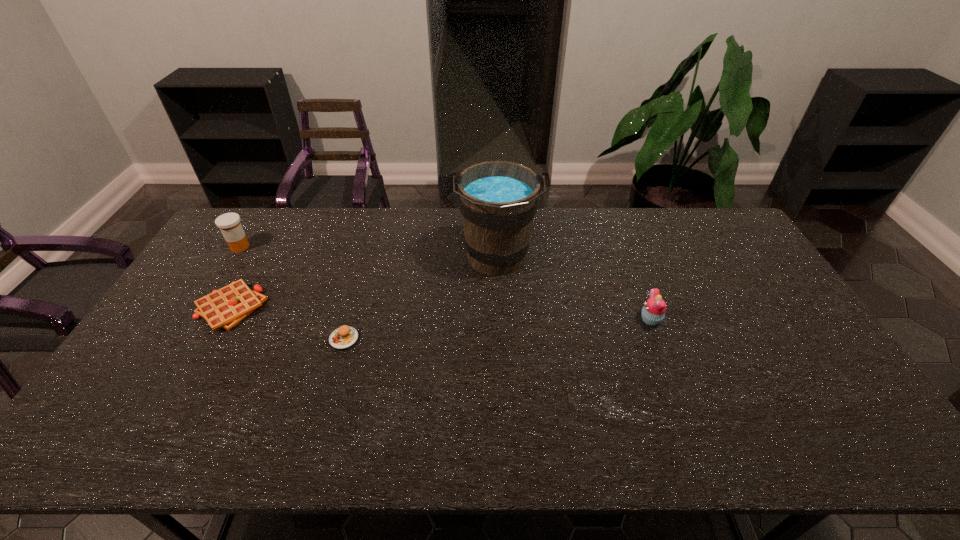
Locate an element on the screen. free point between the tallest object and the waffle is located at coordinates (364, 284).

Locate an element on the screen. Image resolution: width=960 pixels, height=540 pixels. free space between the tallest object and the waffle is located at coordinates (364, 284).

Locate an element on the screen. This screenshot has width=960, height=540. vacant point located between the medicine and the waffle is located at coordinates (235, 278).

What are the coordinates of `blank region between the medicine and the waffle` in the screenshot? It's located at (235, 278).

Image resolution: width=960 pixels, height=540 pixels. What are the coordinates of `vacant space that is in between the patty and the medicine` in the screenshot? It's located at (292, 293).

This screenshot has height=540, width=960. Identify the location of object that stands as the fourth closest to the medicine. point(653,312).

This screenshot has height=540, width=960. I want to click on the second closest object to the third object from right to left, so click(x=497, y=199).

What are the coordinates of `free spot that satisfies the following two spatial constraints: 1. on the label of the medicine; 2. on the left side of the patty` in the screenshot? It's located at (182, 339).

This screenshot has height=540, width=960. What are the coordinates of `vacant area in the image that satisfies the following two spatial constraints: 1. on the front side of the waffle; 2. on the right side of the third object from left to right` in the screenshot? It's located at (214, 339).

In order to click on free space that satisfies the following two spatial constraints: 1. on the label of the medicine; 2. on the right side of the waffle in this screenshot , I will do `click(202, 308)`.